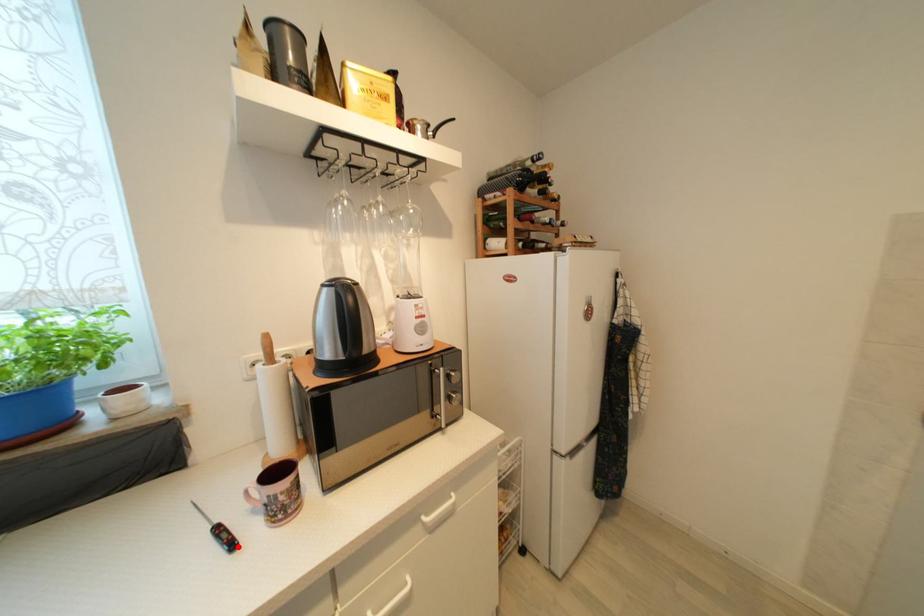
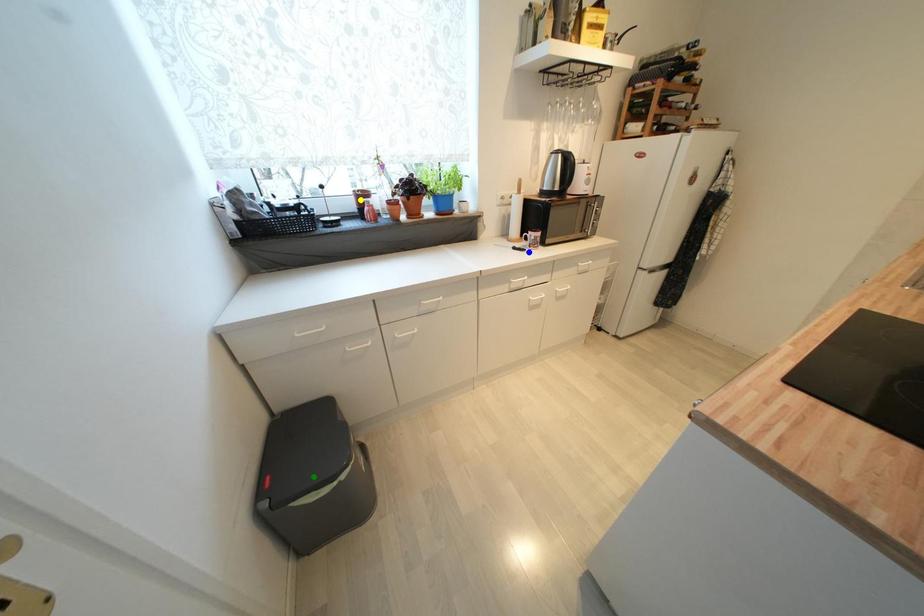
Question: I am providing you with two images of the same scene from different viewpoints. A red point is marked on the first image. You are given multiple points on the second image. Can you choose the point in image 2 that corresponds to the point in image 1?

Choices:
 (A) blue point
 (B) green point
 (C) yellow point

Answer: (A)